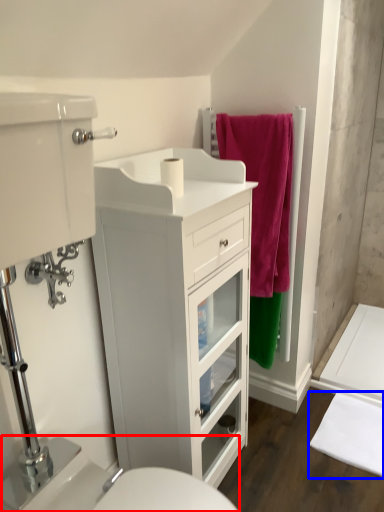
Question: Which object is closer to the camera taking this photo, sink (highlighted by a red box) or bath mat (highlighted by a blue box)?

Choices:
 (A) sink
 (B) bath mat

Answer: (A)